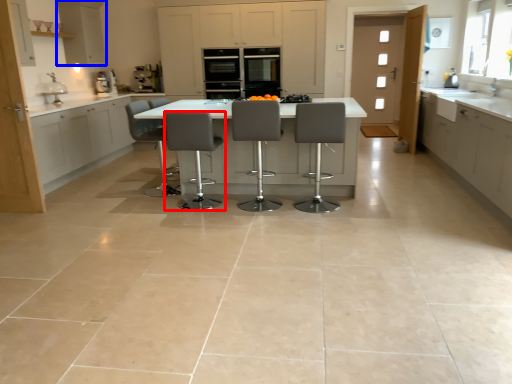
Question: Among these objects, which one is nearest to the camera, chair (highlighted by a red box) or cabinetry (highlighted by a blue box)?

Choices:
 (A) chair
 (B) cabinetry

Answer: (A)